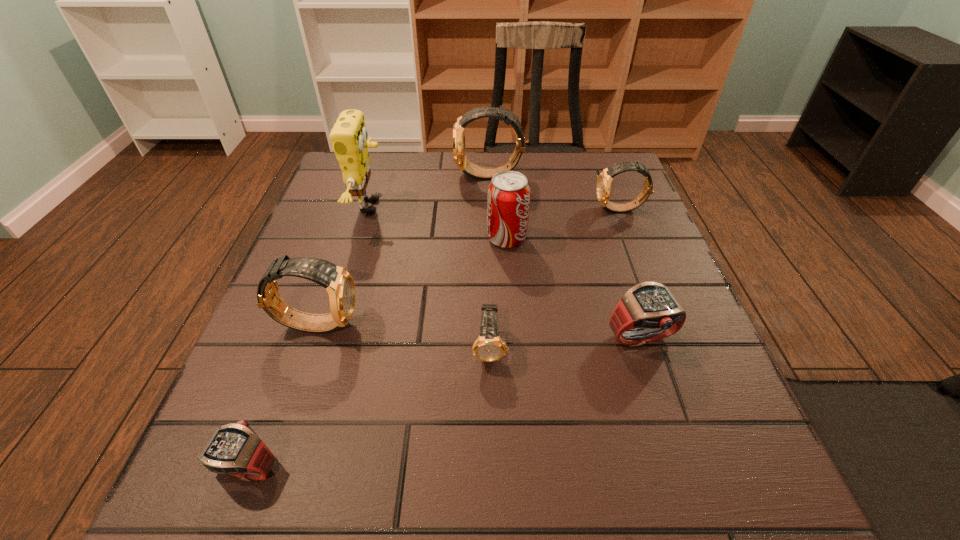
At what (x,y) coordinates should I click in order to perform the action: click on the smallest gold watch. Please return your answer as a coordinate pair (x, y). Looking at the image, I should click on (489, 347).

The height and width of the screenshot is (540, 960). In order to click on the smaller red watch in this screenshot , I will do `click(235, 449)`.

Where is `the shortest object`? The width and height of the screenshot is (960, 540). the shortest object is located at coordinates (235, 449).

In order to click on blank area located 0.110m on the face of the tallest object in this screenshot , I will do `click(434, 206)`.

The width and height of the screenshot is (960, 540). In order to click on vacant region located 0.120m on the face of the tallest watch in this screenshot , I will do `click(410, 176)`.

The image size is (960, 540). Find the location of `free space located 0.120m on the face of the tallest watch`. free space located 0.120m on the face of the tallest watch is located at coordinates (410, 176).

You are a GUI agent. You are given a task and a screenshot of the screen. Output one action in this format:
    pyautogui.click(x=<x>, y=<y>)
    Task: Click on the free location located on the face of the tallest watch
    This screenshot has height=540, width=960.
    Given the screenshot: What is the action you would take?
    pyautogui.click(x=414, y=176)

Find the location of a particular element. This screenshot has width=960, height=540. free space located on the face of the leftmost gold watch is located at coordinates (506, 323).

The width and height of the screenshot is (960, 540). What are the coordinates of `vacant region located 0.190m on the right of the soda` in the screenshot? It's located at click(612, 239).

The width and height of the screenshot is (960, 540). Identify the location of free spot located 0.310m on the face of the fifth tallest object. (467, 210).